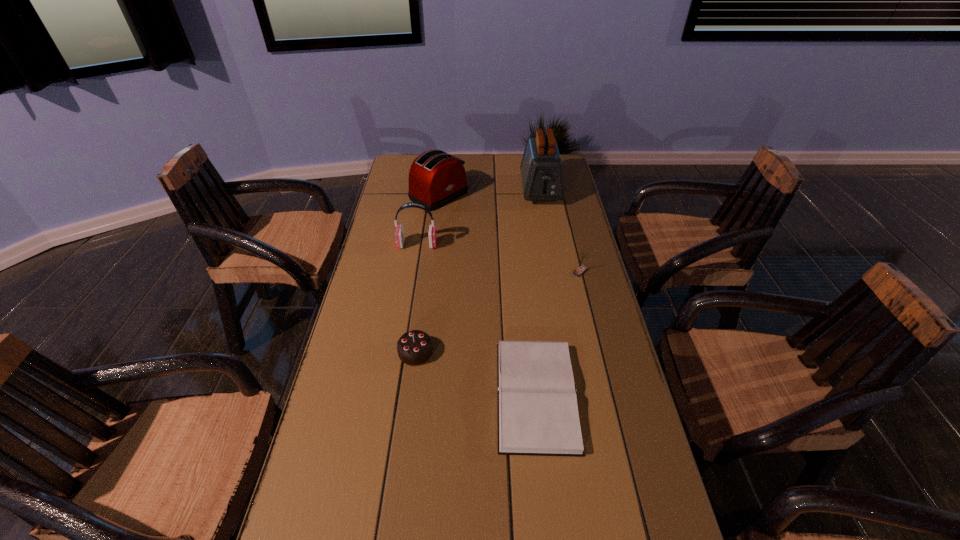
Identify the location of the taller toaster. This screenshot has height=540, width=960. (541, 167).

The image size is (960, 540). In order to click on the tallest object in this screenshot , I will do `click(541, 167)`.

This screenshot has width=960, height=540. Find the location of `the left toaster`. the left toaster is located at coordinates (436, 178).

Locate an element on the screen. the third farthest object is located at coordinates (399, 232).

This screenshot has height=540, width=960. Identify the location of matchbox. (581, 269).

Where is `the third nearest object`? This screenshot has height=540, width=960. the third nearest object is located at coordinates (581, 269).

Find the location of a particular element. chocolate cake is located at coordinates (414, 348).

Locate an element on the screen. The width and height of the screenshot is (960, 540). the shortest object is located at coordinates (538, 414).

Find the location of a particular element. free space located on the front-facing side of the taller toaster is located at coordinates (547, 229).

Find the location of a particular element. vacant space positioned on the back of the shorter toaster is located at coordinates (442, 170).